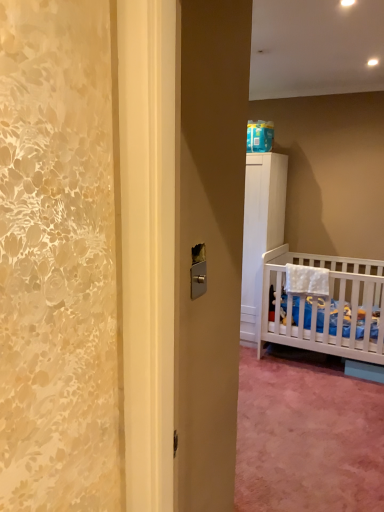
Describe the element at coordinates (209, 244) in the screenshot. Image resolution: width=384 pixels, height=512 pixels. I see `metallic silver screen door at center` at that location.

Image resolution: width=384 pixels, height=512 pixels. Find the location of `metallic silver screen door at center`. metallic silver screen door at center is located at coordinates (209, 244).

Where is `metallic silver screen door at center`? The height and width of the screenshot is (512, 384). metallic silver screen door at center is located at coordinates (209, 244).